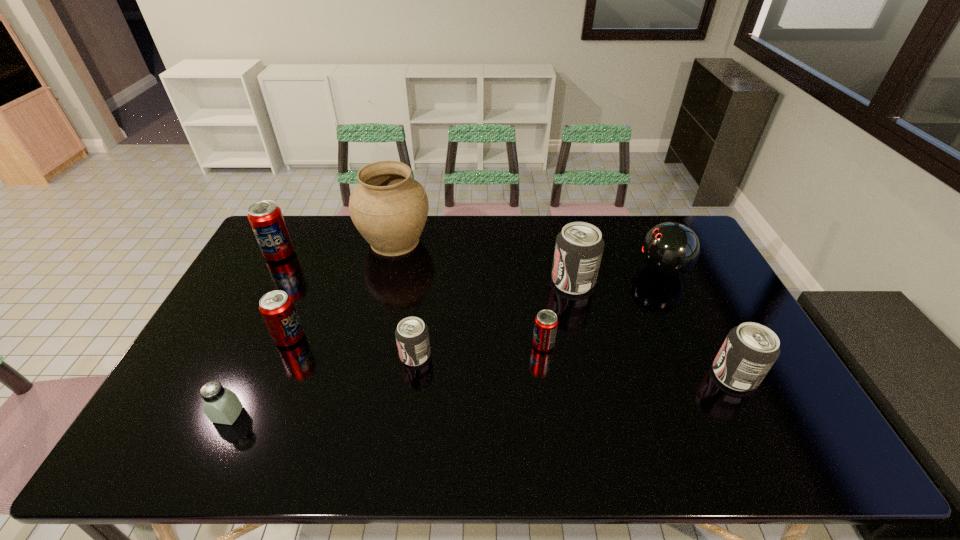
This screenshot has width=960, height=540. What are the coordinates of `free space located on the surface of the black bowling ball near the finger holes` in the screenshot? It's located at (592, 269).

The width and height of the screenshot is (960, 540). What are the coordinates of `free spot located on the surface of the black bowling ball near the finger holes` in the screenshot? It's located at (578, 269).

What are the coordinates of `vacant space located 0.250m on the back of the third object from left to right` in the screenshot? It's located at (317, 271).

Where is `vacant space situated 0.180m on the back of the second smallest black soda can`? The height and width of the screenshot is (540, 960). vacant space situated 0.180m on the back of the second smallest black soda can is located at coordinates (701, 310).

Where is `free region located on the right of the smallest red soda can`? Image resolution: width=960 pixels, height=540 pixels. free region located on the right of the smallest red soda can is located at coordinates (613, 345).

At what (x,y) coordinates should I click in order to perform the action: click on free spot located 0.340m on the back of the leftmost black soda can. Please return your answer as a coordinate pair (x, y). This screenshot has height=540, width=960. Looking at the image, I should click on (427, 265).

Locate an element on the screen. The height and width of the screenshot is (540, 960). vacant space situated on the back of the nearest object is located at coordinates (254, 359).

Locate an element on the screen. The width and height of the screenshot is (960, 540). urn that is at the far edge is located at coordinates (389, 208).

Find the location of `soda can positioned at the far edge`. soda can positioned at the far edge is located at coordinates (266, 219).

I want to click on bowling ball present at the far edge, so click(670, 249).